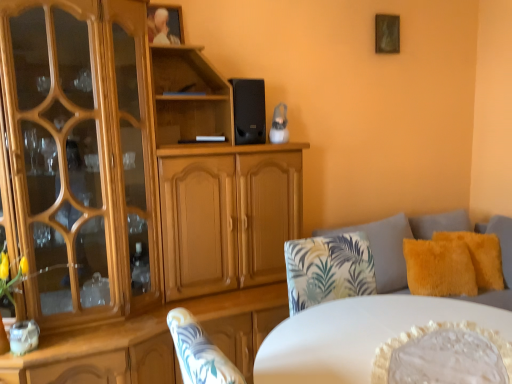
Question: Is fluffy yellow pillow at right, which ranks as the first pillow in right-to-left order, wider than wooden picture frame at upper center, the 1th picture frame when ordered from left to right?

Choices:
 (A) yes
 (B) no

Answer: (A)

Question: Is fluffy yellow pillow at right, which is the second pillow from left to right, far away from wooden picture frame at upper center, the 1th picture frame when ordered from left to right?

Choices:
 (A) yes
 (B) no

Answer: (A)

Question: Can you confirm if fluffy yellow pillow at right, which is the second pillow from left to right, is bigger than wooden picture frame at upper center, the 1th picture frame when ordered from left to right?

Choices:
 (A) no
 (B) yes

Answer: (B)

Question: Could you tell me if fluffy yellow pillow at right, which is the second pillow from left to right, is facing wooden picture frame at upper center, the 1th picture frame in the front-to-back sequence?

Choices:
 (A) yes
 (B) no

Answer: (B)

Question: Is fluffy yellow pillow at right, which is the second pillow from left to right, outside wooden picture frame at upper center, which is counted as the second picture frame, starting from the right?

Choices:
 (A) no
 (B) yes

Answer: (B)

Question: Is fluffy yellow pillow at right, which is the second pillow from left to right, further to camera compared to wooden picture frame at upper center, the second picture frame positioned from the back?

Choices:
 (A) yes
 (B) no

Answer: (A)

Question: Could you tell me if wooden picture frame at upper center, the 1th picture frame when ordered from left to right, is facing fluffy yellow pillow at right, which ranks as the first pillow in right-to-left order?

Choices:
 (A) no
 (B) yes

Answer: (A)

Question: Can you confirm if wooden picture frame at upper center, the second picture frame positioned from the back, is wider than fluffy yellow pillow at right, which ranks as the first pillow in right-to-left order?

Choices:
 (A) no
 (B) yes

Answer: (A)

Question: Can you confirm if wooden picture frame at upper center, the second picture frame positioned from the back, is positioned to the right of fluffy yellow pillow at right, which ranks as the first pillow in right-to-left order?

Choices:
 (A) yes
 (B) no

Answer: (B)

Question: Is fluffy yellow pillow at right, which ranks as the first pillow in right-to-left order, surrounded by wooden picture frame at upper center, the 1th picture frame in the front-to-back sequence?

Choices:
 (A) yes
 (B) no

Answer: (B)

Question: From the image's perspective, does wooden picture frame at upper center, the second picture frame positioned from the back, appear lower than fluffy yellow pillow at right, which ranks as the first pillow in right-to-left order?

Choices:
 (A) no
 (B) yes

Answer: (A)

Question: From the image's perspective, does wooden picture frame at upper center, the 1th picture frame in the front-to-back sequence, appear higher than fluffy yellow pillow at right, which is the second pillow from left to right?

Choices:
 (A) no
 (B) yes

Answer: (B)

Question: Is light brown wood cabinet at center wider than wooden picture frame at upper center, which is counted as the second picture frame, starting from the right?

Choices:
 (A) yes
 (B) no

Answer: (A)